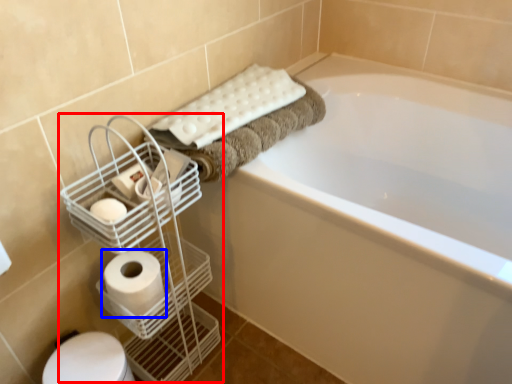
Question: Which object appears farthest to the camera in this image, bird cage (highlighted by a red box) or toilet paper (highlighted by a blue box)?

Choices:
 (A) bird cage
 (B) toilet paper

Answer: (B)